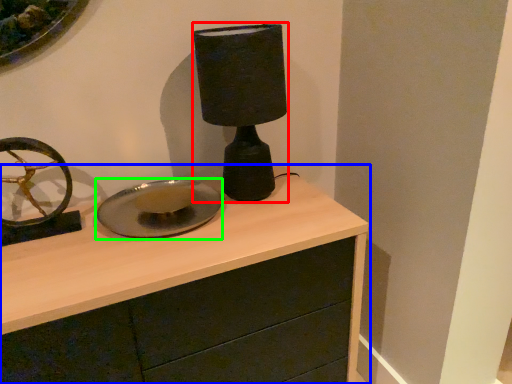
Question: Based on their relative distances, which object is nearer to table lamp (highlighted by a red box)? Choose from chest of drawers (highlighted by a blue box) and plate (highlighted by a green box).

Choices:
 (A) chest of drawers
 (B) plate

Answer: (B)